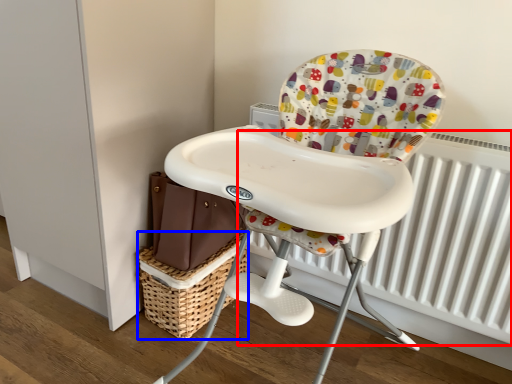
Question: Which object appears farthest to the camera in this image, radiator (highlighted by a red box) or basket (highlighted by a blue box)?

Choices:
 (A) radiator
 (B) basket

Answer: (B)